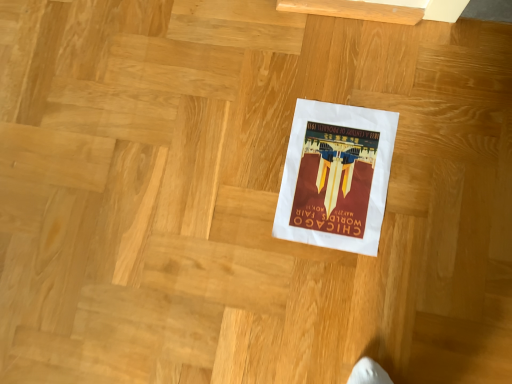
Identify the location of free space behind white paper poster at center. Image resolution: width=512 pixels, height=384 pixels. (275, 89).